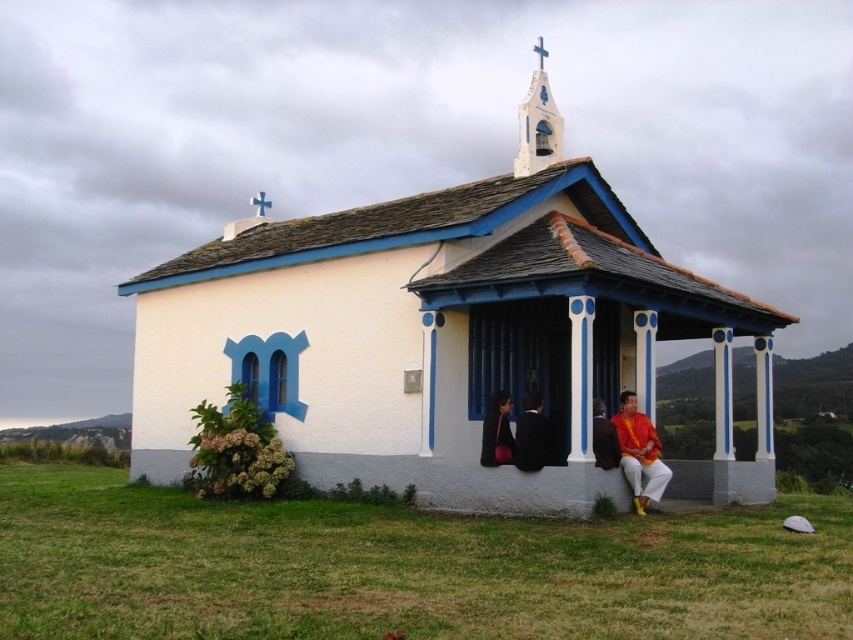
You are a photographer planning to take a group photo of the two people wearing the matte black suit at center and the matte black jacket at center in front of the chapel. Considering their clothing, which one should stand in the back to avoid being obscured by the other?

The matte black suit at center has a greater height compared to the matte black jacket at center, so the taller person wearing the matte black suit at center should stand in the back to avoid being obscured by the shorter one.

You are standing in front of the chapel and see two people wearing matte black attire. The first person is wearing a matte black jacket at center, and the second is wearing a matte black suit at center. From your perspective, which person is standing to the right of the other?

The matte black suit at center is to the right of the matte black jacket at center.

You are standing at the entrance of the chapel and notice the white painted wood bell at upper center and the matte black jacket at center. Which object is located higher in the image?

The white painted wood bell at upper center is positioned over the matte black jacket at center, so it is higher.